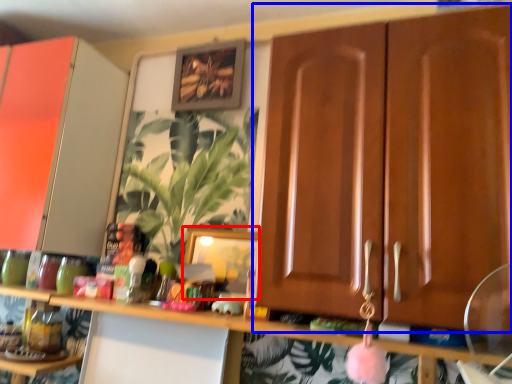
Question: Among these objects, which one is farthest to the camera, picture frame (highlighted by a red box) or cabinetry (highlighted by a blue box)?

Choices:
 (A) picture frame
 (B) cabinetry

Answer: (A)